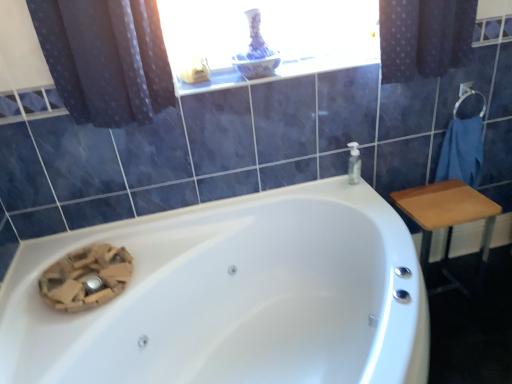
Question: From a real-world perspective, does white glossy window sill at upper center sit lower than transparent plastic soap dispenser at upper right?

Choices:
 (A) yes
 (B) no

Answer: (B)

Question: From a real-world perspective, does white glossy window sill at upper center stand above transparent plastic soap dispenser at upper right?

Choices:
 (A) no
 (B) yes

Answer: (B)

Question: Is white glossy window sill at upper center facing away from transparent plastic soap dispenser at upper right?

Choices:
 (A) no
 (B) yes

Answer: (A)

Question: From the image's perspective, is white glossy window sill at upper center below transparent plastic soap dispenser at upper right?

Choices:
 (A) no
 (B) yes

Answer: (A)

Question: Would you say white glossy window sill at upper center is outside transparent plastic soap dispenser at upper right?

Choices:
 (A) yes
 (B) no

Answer: (A)

Question: From a real-world perspective, relative to wooden table at right, is transparent plastic soap dispenser at upper right vertically above or below?

Choices:
 (A) below
 (B) above

Answer: (B)

Question: Is point (352, 182) closer or farther from the camera than point (482, 258)?

Choices:
 (A) farther
 (B) closer

Answer: (B)

Question: From the image's perspective, relative to wooden table at right, is transparent plastic soap dispenser at upper right above or below?

Choices:
 (A) above
 (B) below

Answer: (A)

Question: Based on their sizes in the image, would you say transparent plastic soap dispenser at upper right is bigger or smaller than wooden table at right?

Choices:
 (A) big
 (B) small

Answer: (B)

Question: From a real-world perspective, is wooden table at right above or below white glossy bathtub at center?

Choices:
 (A) above
 (B) below

Answer: (B)

Question: Is wooden table at right bigger or smaller than white glossy bathtub at center?

Choices:
 (A) big
 (B) small

Answer: (B)

Question: Relative to white glossy bathtub at center, is wooden table at right in front or behind?

Choices:
 (A) front
 (B) behind

Answer: (B)

Question: In the image, is wooden table at right on the left side or the right side of white glossy bathtub at center?

Choices:
 (A) right
 (B) left

Answer: (A)

Question: Is white glossy bathtub at center spatially inside white glossy window sill at upper center, or outside of it?

Choices:
 (A) outside
 (B) inside

Answer: (A)

Question: From a real-world perspective, is white glossy bathtub at center physically located above or below white glossy window sill at upper center?

Choices:
 (A) above
 (B) below

Answer: (B)